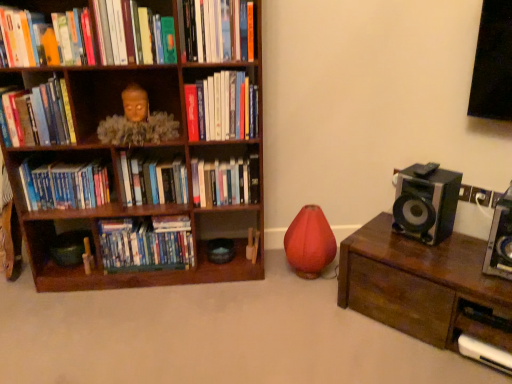
This screenshot has width=512, height=384. I want to click on free space underneath matte red vase at center (from a real-world perspective), so click(x=309, y=272).